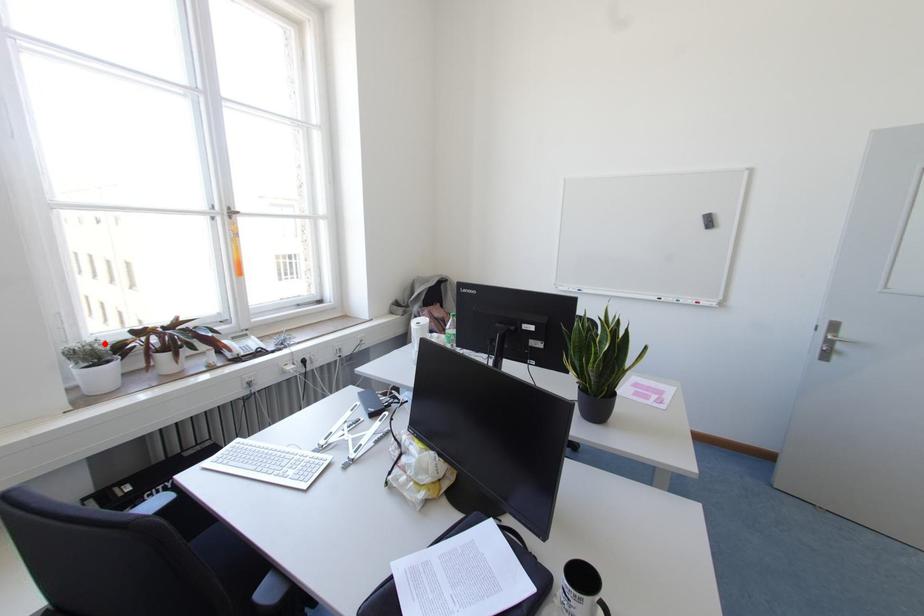
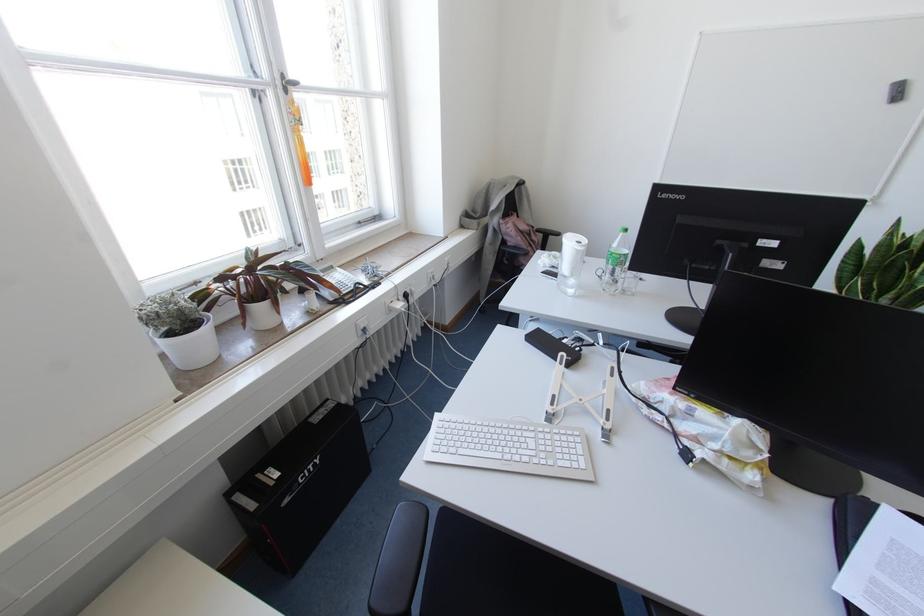
Question: I am providing you with two images of the same scene from different viewpoints. A red point is marked on the first image. Can you still see the location of the red point in image 2?

Choices:
 (A) Yes
 (B) No

Answer: (A)